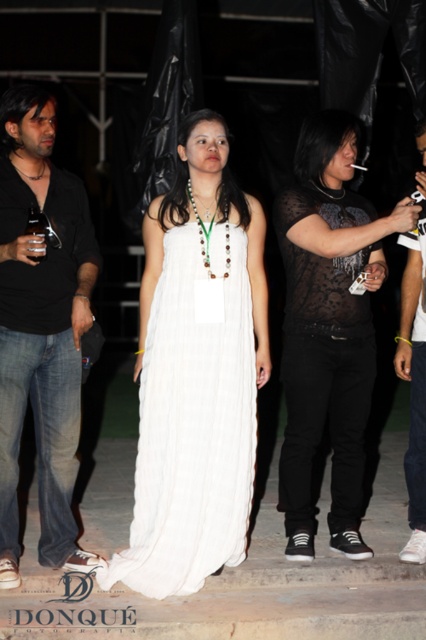
Question: Estimate the real-world distances between objects in this image. Which object is closer to the white fabric shirt at right?

Choices:
 (A) matte black dress at center
 (B) white pleated dress at center
 (C) black matte shirt at left

Answer: (A)

Question: Is white pleated dress at center to the left of matte black dress at center from the viewer's perspective?

Choices:
 (A) yes
 (B) no

Answer: (A)

Question: Can you confirm if white pleated dress at center is thinner than black matte shirt at left?

Choices:
 (A) yes
 (B) no

Answer: (B)

Question: Which point is closer to the camera?

Choices:
 (A) (333, 397)
 (B) (0, 120)

Answer: (B)

Question: Which object is closer to the camera taking this photo?

Choices:
 (A) matte black dress at center
 (B) white pleated dress at center
 (C) black matte shirt at left

Answer: (C)

Question: Does white pleated dress at center have a lesser width compared to black matte shirt at left?

Choices:
 (A) yes
 (B) no

Answer: (B)